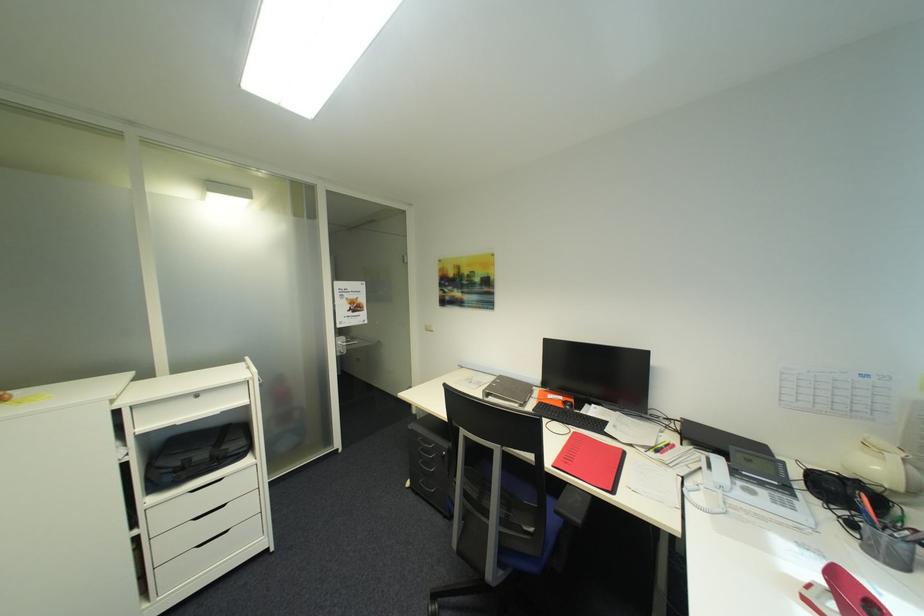
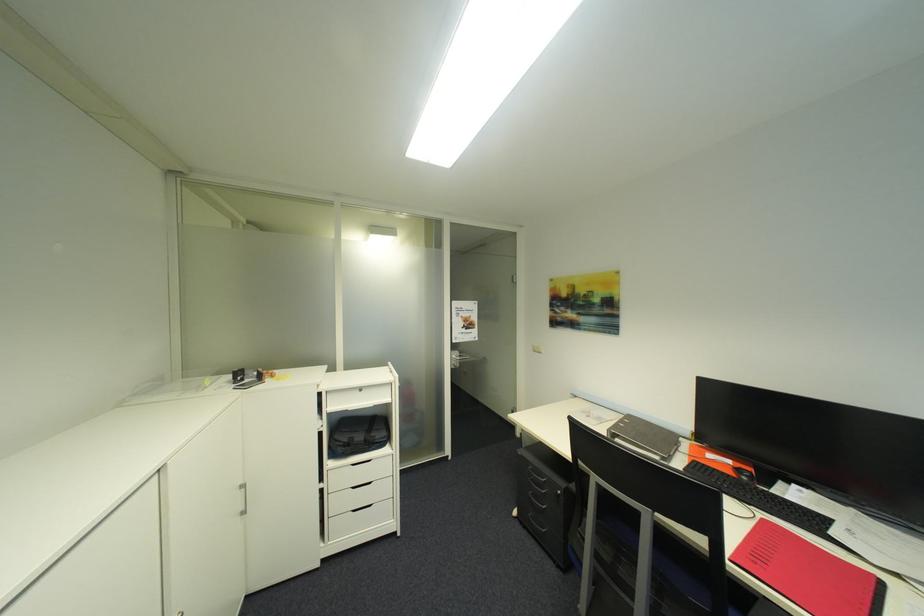
Question: The camera is either moving clockwise (left) or counter-clockwise (right) around the object. The first image is from the beginning of the video and the second image is from the end. Is the camera moving left or right when shooting the video?

Choices:
 (A) Left
 (B) Right

Answer: (B)